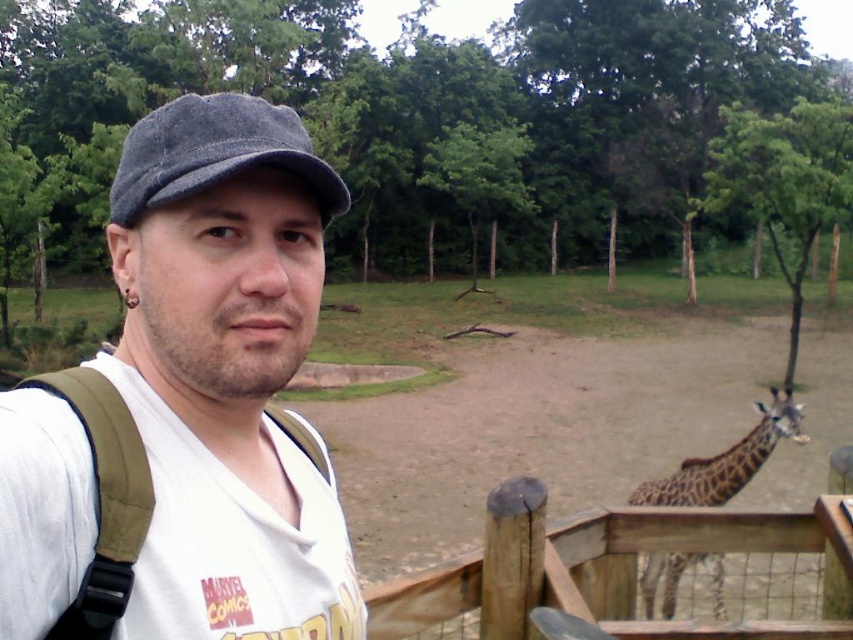
Can you confirm if wooden at right is positioned to the left of denim cap at center?

No, wooden at right is not to the left of denim cap at center.

Who is higher up, wooden at right or denim cap at center?

denim cap at center

I want to click on wooden at right, so click(627, 576).

Between point (148, 122) and point (674, 579), which one is positioned behind?

Point (674, 579)

From the picture: Which of these two, denim cap at center or brown spotted giraffe at lower right, stands shorter?

brown spotted giraffe at lower right

Which is behind, point (137, 129) or point (776, 410)?

Positioned behind is point (776, 410).

The width and height of the screenshot is (853, 640). What are the coordinates of `denim cap at center` in the screenshot? It's located at (215, 154).

Which of these two, wooden at right or brown spotted giraffe at lower right, stands shorter?

With less height is wooden at right.

Does wooden at right have a lesser width compared to brown spotted giraffe at lower right?

No.

Does point (614, 605) lie behind point (646, 493)?

No, it is in front of (646, 493).

Where is `wooden at right`? wooden at right is located at coordinates (627, 576).